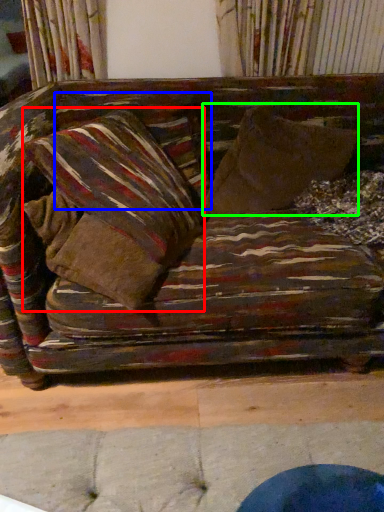
Question: Which is farther away from pillow (highlighted by a red box)? pillow (highlighted by a blue box) or throw pillow (highlighted by a green box)?

Choices:
 (A) pillow
 (B) throw pillow

Answer: (B)